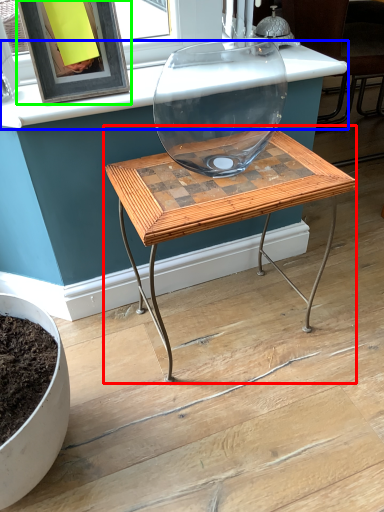
Question: Which object is the farthest from table (highlighted by a red box)? Choose among these: counter top (highlighted by a blue box) or picture frame (highlighted by a green box).

Choices:
 (A) counter top
 (B) picture frame

Answer: (B)